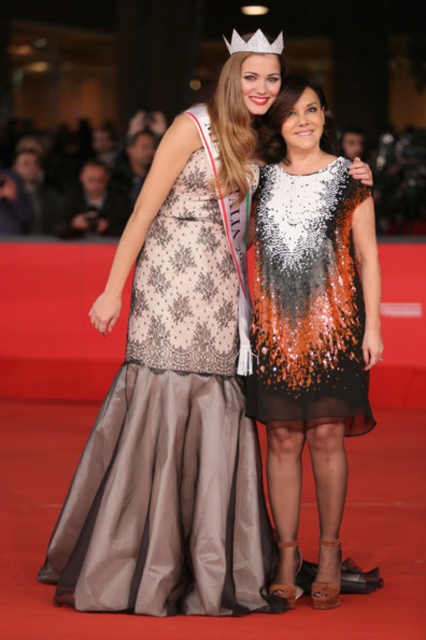
Does matte silver gown at center have a greater height compared to matte beige dress at upper center?

In fact, matte silver gown at center may be shorter than matte beige dress at upper center.

Does point (31, 145) lie behind point (146, 152)?

That is True.

This screenshot has width=426, height=640. I want to click on matte silver gown at center, so click(400, 182).

Does point (288, 400) come behind point (416, 220)?

That is False.

I want to click on sequined sheer dress at center, so click(x=307, y=300).

What are the coordinates of `sequined sheer dress at center` in the screenshot? It's located at (307, 300).

Where is `sequined sheer dress at center`? The width and height of the screenshot is (426, 640). sequined sheer dress at center is located at coordinates (307, 300).

Does matte beige lace dress at center have a larger size compared to matte silver gown at center?

Actually, matte beige lace dress at center might be smaller than matte silver gown at center.

The image size is (426, 640). Find the location of `matte beige lace dress at center`. matte beige lace dress at center is located at coordinates (173, 429).